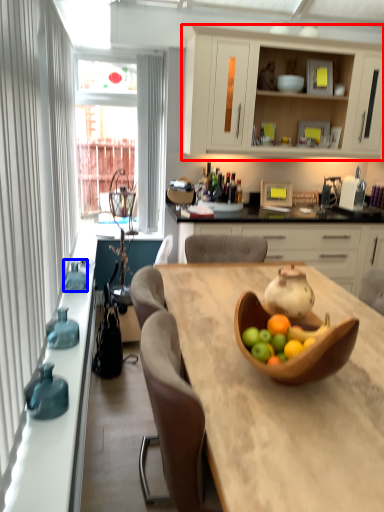
Question: Which of the following is the closest to the observer, cabinetry (highlighted by a red box) or vase (highlighted by a blue box)?

Choices:
 (A) cabinetry
 (B) vase

Answer: (B)